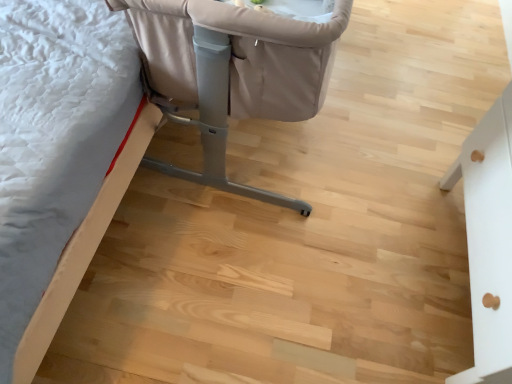
In the scene shown: What is the approximate height of white matte drawer at right, which is counted as the first furniture, starting from the right?

56.95 centimeters.

In order to face beige fabric crib at upper left, the 3th furniture in the right-to-left sequence, should I rotate leftwards or rightwards?

To face it directly, rotate left by 0.846 degrees.

What do you see at coordinates (118, 125) in the screenshot? I see `beige fabric crib at upper left, the 3th furniture in the right-to-left sequence` at bounding box center [118, 125].

The width and height of the screenshot is (512, 384). Describe the element at coordinates (234, 71) in the screenshot. I see `beige fabric crib at upper center, the second furniture from the right` at that location.

This screenshot has width=512, height=384. Identify the location of white matte drawer at right, which is counted as the first furniture, starting from the right. (488, 240).

Considering the positions of point (504, 296) and point (155, 167), is point (504, 296) closer or farther from the camera than point (155, 167)?

Point (504, 296) is closer to the camera than point (155, 167).

Is white matte drawer at right, which appears as the third furniture when viewed from the left, inside the boundaries of beige fabric crib at upper center, arranged as the second furniture when viewed from the left, or outside?

white matte drawer at right, which appears as the third furniture when viewed from the left, exists outside the volume of beige fabric crib at upper center, arranged as the second furniture when viewed from the left.

Is there a large distance between white matte drawer at right, which appears as the third furniture when viewed from the left, and beige fabric crib at upper center, arranged as the second furniture when viewed from the left?

No, white matte drawer at right, which appears as the third furniture when viewed from the left, is not far from beige fabric crib at upper center, arranged as the second furniture when viewed from the left.

Between white matte drawer at right, which appears as the third furniture when viewed from the left, and beige fabric crib at upper center, the second furniture from the right, which one appears on the left side from the viewer's perspective?

beige fabric crib at upper center, the second furniture from the right, is more to the left.

From the image's perspective, is beige fabric crib at upper left, the 3th furniture in the right-to-left sequence, positioned above or below beige fabric crib at upper center, the second furniture from the right?

Based on their image positions, beige fabric crib at upper left, the 3th furniture in the right-to-left sequence, is located beneath beige fabric crib at upper center, the second furniture from the right.

Does beige fabric crib at upper left, the 3th furniture in the right-to-left sequence, touch beige fabric crib at upper center, arranged as the second furniture when viewed from the left?

No, beige fabric crib at upper left, the 3th furniture in the right-to-left sequence, is not with beige fabric crib at upper center, arranged as the second furniture when viewed from the left.

Is beige fabric crib at upper left, the 3th furniture in the right-to-left sequence, closer to the viewer compared to beige fabric crib at upper center, the second furniture from the right?

That is False.

How distant is white matte drawer at right, which is counted as the first furniture, starting from the right, from beige fabric crib at upper left, which is counted as the first furniture, starting from the left?

white matte drawer at right, which is counted as the first furniture, starting from the right, is 31.19 inches away from beige fabric crib at upper left, which is counted as the first furniture, starting from the left.

From the image's perspective, count 1st furnitures upward from the white matte drawer at right, which is counted as the first furniture, starting from the right, and point to it. Please provide its 2D coordinates.

[(118, 125)]

Is white matte drawer at right, which appears as the third furniture when viewed from the left, positioned beyond the bounds of beige fabric crib at upper left, which is counted as the first furniture, starting from the left?

white matte drawer at right, which appears as the third furniture when viewed from the left, is positioned outside beige fabric crib at upper left, which is counted as the first furniture, starting from the left.

Is white matte drawer at right, which appears as the third furniture when viewed from the left, smaller than beige fabric crib at upper left, the 3th furniture in the right-to-left sequence?

Indeed, white matte drawer at right, which appears as the third furniture when viewed from the left, has a smaller size compared to beige fabric crib at upper left, the 3th furniture in the right-to-left sequence.

What's the angular difference between beige fabric crib at upper center, arranged as the second furniture when viewed from the left, and beige fabric crib at upper left, which is counted as the first furniture, starting from the left,'s facing directions?

The angular difference between beige fabric crib at upper center, arranged as the second furniture when viewed from the left, and beige fabric crib at upper left, which is counted as the first furniture, starting from the left, is 91.2 degrees.

Does beige fabric crib at upper center, arranged as the second furniture when viewed from the left, have a lesser height compared to beige fabric crib at upper left, the 3th furniture in the right-to-left sequence?

In fact, beige fabric crib at upper center, arranged as the second furniture when viewed from the left, may be taller than beige fabric crib at upper left, the 3th furniture in the right-to-left sequence.

Looking at this image, considering the positions of objects beige fabric crib at upper center, arranged as the second furniture when viewed from the left, and beige fabric crib at upper left, the 3th furniture in the right-to-left sequence, in the image provided, who is more to the right, beige fabric crib at upper center, arranged as the second furniture when viewed from the left, or beige fabric crib at upper left, the 3th furniture in the right-to-left sequence,?

From the viewer's perspective, beige fabric crib at upper center, arranged as the second furniture when viewed from the left, appears more on the right side.

Consider the image. From the image's perspective, between beige fabric crib at upper center, arranged as the second furniture when viewed from the left, and beige fabric crib at upper left, which is counted as the first furniture, starting from the left, who is located below?

From the image's view, beige fabric crib at upper left, which is counted as the first furniture, starting from the left, is below.

From a real-world perspective, which object rests below the other?

In real-world perspective, beige fabric crib at upper left, the 3th furniture in the right-to-left sequence, is lower.

Which of these two, beige fabric crib at upper left, the 3th furniture in the right-to-left sequence, or white matte drawer at right, which appears as the third furniture when viewed from the left, is bigger?

beige fabric crib at upper left, the 3th furniture in the right-to-left sequence, is bigger.

Are beige fabric crib at upper left, which is counted as the first furniture, starting from the left, and white matte drawer at right, which is counted as the first furniture, starting from the right, far apart?

beige fabric crib at upper left, which is counted as the first furniture, starting from the left, is near white matte drawer at right, which is counted as the first furniture, starting from the right, not far away.

From the image's perspective, who appears lower, beige fabric crib at upper center, arranged as the second furniture when viewed from the left, or white matte drawer at right, which appears as the third furniture when viewed from the left?

white matte drawer at right, which appears as the third furniture when viewed from the left, appears lower in the image.

From the picture: Which object is closer to the camera, beige fabric crib at upper center, the second furniture from the right, or white matte drawer at right, which appears as the third furniture when viewed from the left?

Positioned in front is white matte drawer at right, which appears as the third furniture when viewed from the left.

Considering the relative positions of beige fabric crib at upper center, arranged as the second furniture when viewed from the left, and white matte drawer at right, which appears as the third furniture when viewed from the left, in the image provided, is beige fabric crib at upper center, arranged as the second furniture when viewed from the left, to the right of white matte drawer at right, which appears as the third furniture when viewed from the left, from the viewer's perspective?

In fact, beige fabric crib at upper center, arranged as the second furniture when viewed from the left, is to the left of white matte drawer at right, which appears as the third furniture when viewed from the left.

From the image's perspective, count 2nd furnitures downward from the beige fabric crib at upper center, the second furniture from the right, and point to it. Please provide its 2D coordinates.

[(488, 240)]

Identify the location of the 1st furniture to the left of the white matte drawer at right, which is counted as the first furniture, starting from the right, counting from the anchor's position. The width and height of the screenshot is (512, 384). (234, 71).

Where is `furniture that is the 1st one when counting forward from the beige fabric crib at upper left, which is counted as the first furniture, starting from the left`? The height and width of the screenshot is (384, 512). furniture that is the 1st one when counting forward from the beige fabric crib at upper left, which is counted as the first furniture, starting from the left is located at coordinates (234, 71).

Estimate the real-world distances between objects in this image. Which object is further from beige fabric crib at upper center, the second furniture from the right, white matte drawer at right, which is counted as the first furniture, starting from the right, or beige fabric crib at upper left, which is counted as the first furniture, starting from the left?

white matte drawer at right, which is counted as the first furniture, starting from the right, lies further to beige fabric crib at upper center, the second furniture from the right, than the other object.

From the image, which object appears to be nearer to white matte drawer at right, which is counted as the first furniture, starting from the right, beige fabric crib at upper center, the second furniture from the right, or beige fabric crib at upper left, the 3th furniture in the right-to-left sequence?

beige fabric crib at upper center, the second furniture from the right, lies closer to white matte drawer at right, which is counted as the first furniture, starting from the right, than the other object.

Based on the photo, considering their positions, is white matte drawer at right, which is counted as the first furniture, starting from the right, positioned closer to beige fabric crib at upper left, the 3th furniture in the right-to-left sequence, than beige fabric crib at upper center, arranged as the second furniture when viewed from the left?

beige fabric crib at upper center, arranged as the second furniture when viewed from the left, lies closer to beige fabric crib at upper left, the 3th furniture in the right-to-left sequence, than the other object.

Based on their spatial positions, is beige fabric crib at upper left, the 3th furniture in the right-to-left sequence, or white matte drawer at right, which appears as the third furniture when viewed from the left, closer to beige fabric crib at upper center, the second furniture from the right?

beige fabric crib at upper left, the 3th furniture in the right-to-left sequence.

Estimate the real-world distances between objects in this image. Which object is further from beige fabric crib at upper left, which is counted as the first furniture, starting from the left, beige fabric crib at upper center, the second furniture from the right, or white matte drawer at right, which is counted as the first furniture, starting from the right?

The object further to beige fabric crib at upper left, which is counted as the first furniture, starting from the left, is white matte drawer at right, which is counted as the first furniture, starting from the right.

Based on their spatial positions, is beige fabric crib at upper left, the 3th furniture in the right-to-left sequence, or beige fabric crib at upper center, arranged as the second furniture when viewed from the left, closer to white matte drawer at right, which is counted as the first furniture, starting from the right?

Based on the image, beige fabric crib at upper center, arranged as the second furniture when viewed from the left, appears to be nearer to white matte drawer at right, which is counted as the first furniture, starting from the right.

Where is `furniture between beige fabric crib at upper left, the 3th furniture in the right-to-left sequence, and white matte drawer at right, which is counted as the first furniture, starting from the right, from left to right`? The image size is (512, 384). furniture between beige fabric crib at upper left, the 3th furniture in the right-to-left sequence, and white matte drawer at right, which is counted as the first furniture, starting from the right, from left to right is located at coordinates (234, 71).